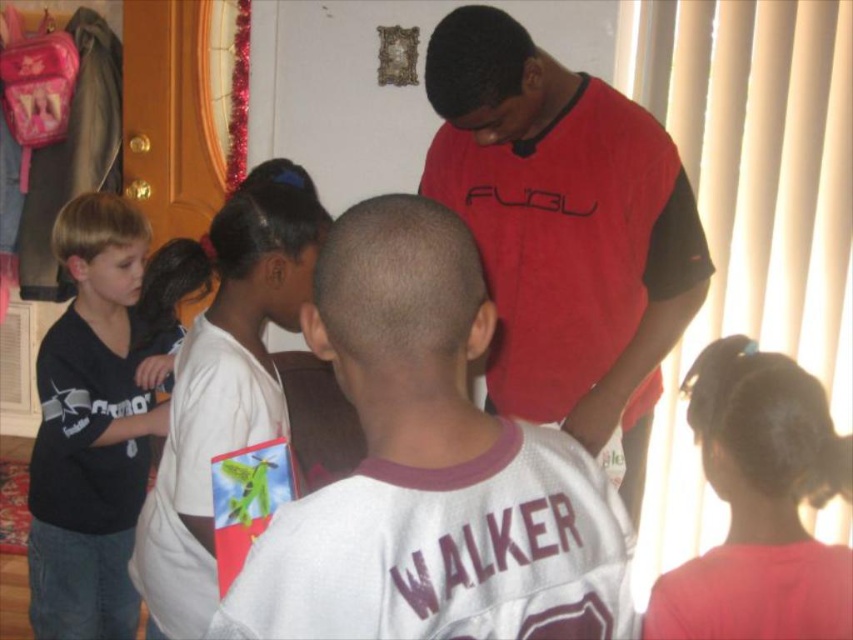
Does red matte shirt at center appear under black matte shirt at left?

Actually, red matte shirt at center is above black matte shirt at left.

Identify the location of red matte shirt at center. (564, 228).

This screenshot has width=853, height=640. I want to click on red matte shirt at center, so click(x=564, y=228).

Is black matte shirt at left in front of white matte shirt at upper left?

No.

Which is behind, point (71, 236) or point (221, 252)?

Point (71, 236)

Image resolution: width=853 pixels, height=640 pixels. Identify the location of black matte shirt at left. (93, 426).

Is point (175, 609) in front of point (775, 424)?

No, (175, 609) is further to viewer.

Is white matte shirt at upper left closer to camera compared to dark brown hair at upper right?

No.

Between point (189, 280) and point (714, 477), which one is positioned in front?

Point (714, 477)

In order to click on white matte shirt at upper left in this screenshot , I will do `click(219, 376)`.